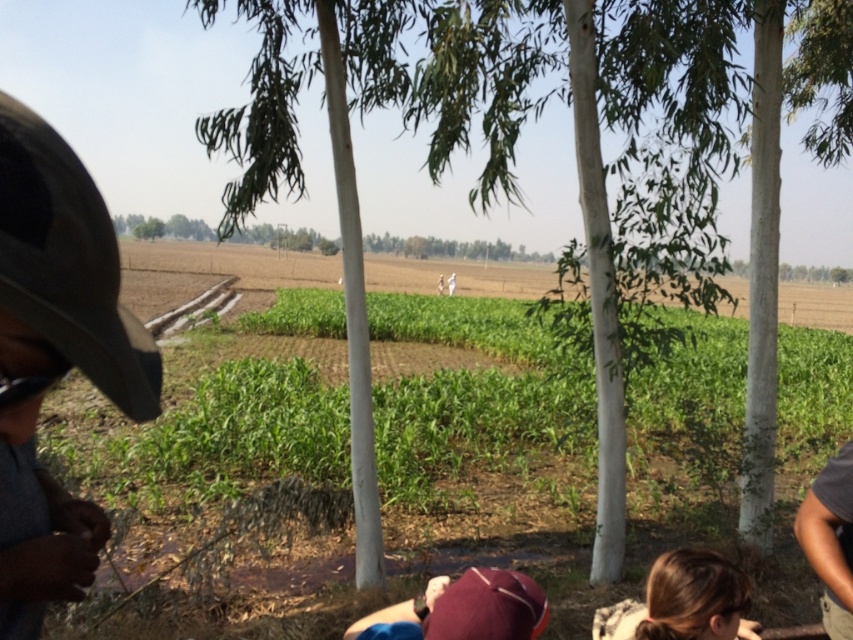
Question: Which point is farther to the camera?

Choices:
 (A) (41, 570)
 (B) (838, 541)
 (C) (477, 589)

Answer: (C)

Question: Does green leafy tree at center appear on the right side of dark gray shirt at lower right?

Choices:
 (A) yes
 (B) no

Answer: (A)

Question: Which is farther from the camouflage fabric cap at lower left?

Choices:
 (A) maroon fabric cap at lower center
 (B) dark gray shirt at lower right
 (C) blonde hair at lower right

Answer: (B)

Question: Where is green leafy tree at center located in relation to camouflage fabric cap at lower left in the image?

Choices:
 (A) left
 (B) right

Answer: (B)

Question: Does camouflage fabric cap at lower left appear over blonde hair at lower right?

Choices:
 (A) yes
 (B) no

Answer: (A)

Question: Which is nearer to the maroon fabric cap at lower center?

Choices:
 (A) camouflage fabric cap at lower left
 (B) dark gray shirt at lower right
 (C) blonde hair at lower right

Answer: (C)